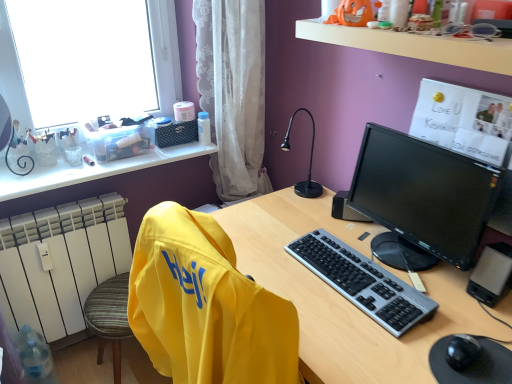
Image resolution: width=512 pixels, height=384 pixels. I want to click on vacant space to the left of black plastic speaker at right, so click(x=305, y=210).